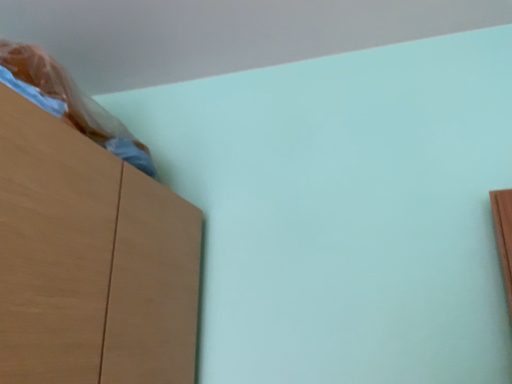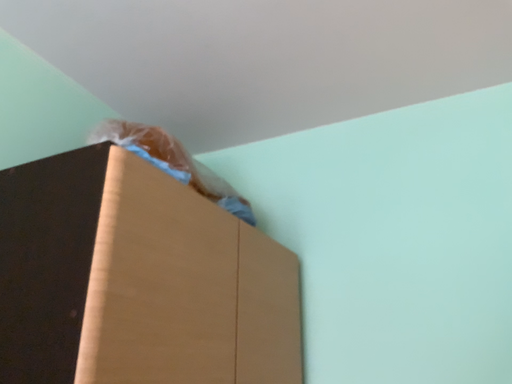
Question: Which way did the camera rotate in the video?

Choices:
 (A) rotated right
 (B) rotated left

Answer: (B)